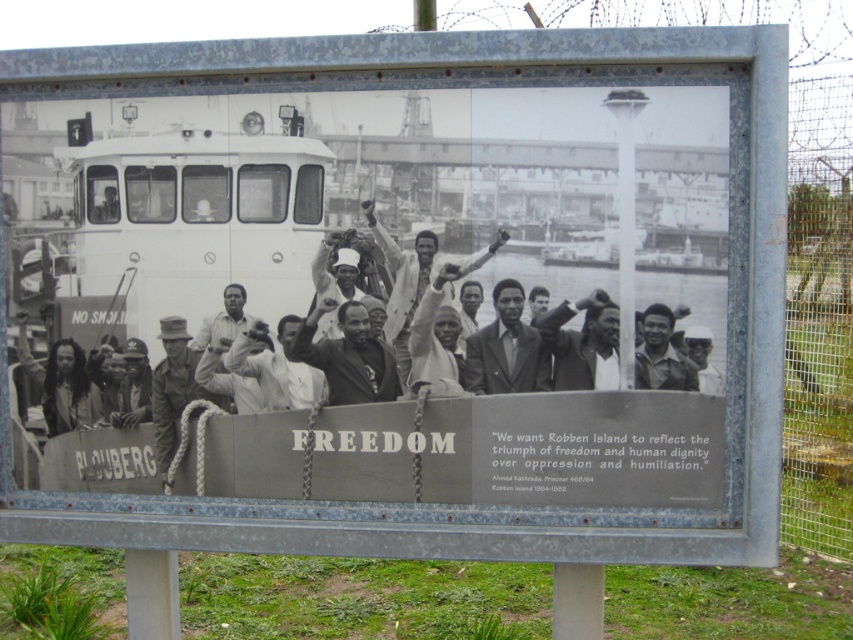
You are a tour guide at Robben Island and notice two individuals on the historical plaque. One is the long hair person at left and the other is the smooth skin face at center. Based on their positions in the photograph, which person appears to be standing closer to the front of the dock?

The smooth skin face at center appears to be standing closer to the front of the dock because the long hair person at left is much taller, which suggests that the smooth skin face at center might be positioned in front, making the long hair person at left seem taller in the photo.

You are a tour guide at Robben Island, and you notice two men in suits in the photograph on the memorial plaque. The men are wearing a light gray suit at center and a light beige suit at center. A visitor asks if they can fit both men between them for a photo. If the visitors are 1.5 meters apart, will there be enough space between the two men in the photo?

The distance between the light gray suit at center and the light beige suit at center is 38.08 centimeters. Since 38.08 centimeters is less than 1.5 meters, the visitors would not have enough space to fit between them at that distance.